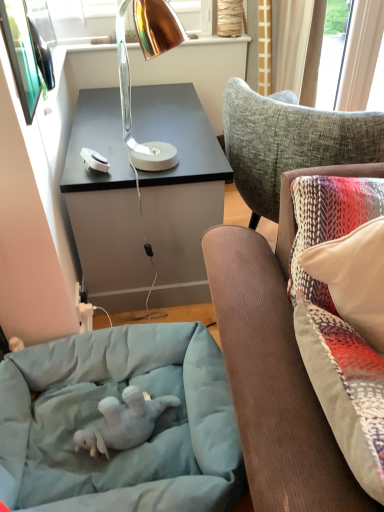
Question: From a real-world perspective, is light blue fabric dog bed at lower left physically located above or below copper metallic desk lamp at upper center?

Choices:
 (A) above
 (B) below

Answer: (B)

Question: Looking at the image, does light blue fabric dog bed at lower left seem bigger or smaller compared to copper metallic desk lamp at upper center?

Choices:
 (A) small
 (B) big

Answer: (B)

Question: Which of these objects is positioned farthest from the suede couch cushion at right?

Choices:
 (A) soft gray plush baby elephant at lower left
 (B) light blue fabric dog bed at lower left
 (C) copper metallic desk lamp at upper center

Answer: (C)

Question: Which is farther from the light blue fabric dog bed at lower left?

Choices:
 (A) suede couch cushion at right
 (B) soft gray plush baby elephant at lower left
 (C) copper metallic desk lamp at upper center

Answer: (C)